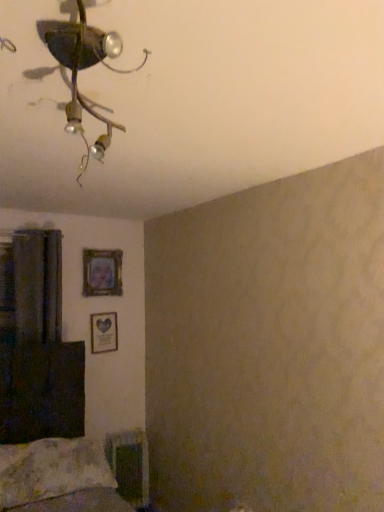
Question: Considering the positions of matte wooden picture frame at upper left, acting as the 1th picture frame starting from the top, and metallic ceiling fixture at upper left in the image, is matte wooden picture frame at upper left, acting as the 1th picture frame starting from the top, wider or thinner than metallic ceiling fixture at upper left?

Choices:
 (A) wide
 (B) thin

Answer: (B)

Question: Considering the relative positions of matte wooden picture frame at upper left, which is the second picture frame in bottom-to-top order, and metallic ceiling fixture at upper left in the image provided, is matte wooden picture frame at upper left, which is the second picture frame in bottom-to-top order, to the left or to the right of metallic ceiling fixture at upper left?

Choices:
 (A) left
 (B) right

Answer: (A)

Question: Which object is the closest to the fluffy white pillow at lower left?

Choices:
 (A) metallic ceiling fixture at upper left
 (B) dark brown fabric curtain at left
 (C) matte wooden picture frame at upper left, which is the second picture frame in bottom-to-top order
 (D) wooden picture frame at center-left, which is the 1th picture frame from bottom to top

Answer: (B)

Question: Estimate the real-world distances between objects in this image. Which object is farther from the dark brown fabric curtain at left?

Choices:
 (A) matte wooden picture frame at upper left, acting as the 1th picture frame starting from the top
 (B) wooden picture frame at center-left, marked as the second picture frame in a top-to-bottom arrangement
 (C) fluffy white pillow at lower left
 (D) metallic ceiling fixture at upper left

Answer: (D)